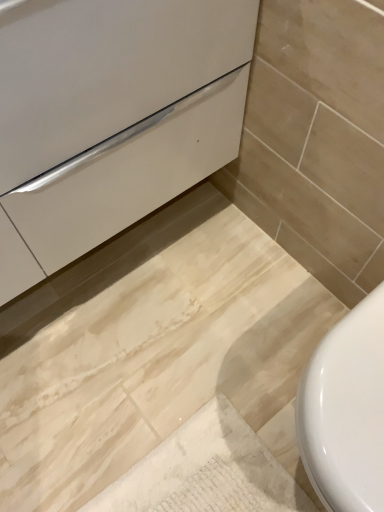
Question: Is white glossy drawer at center to the left or to the right of white glossy toilet at lower right in the image?

Choices:
 (A) left
 (B) right

Answer: (A)

Question: From a real-world perspective, is white glossy drawer at center positioned above or below white glossy toilet at lower right?

Choices:
 (A) below
 (B) above

Answer: (B)

Question: From the image's perspective, is white glossy drawer at center above or below white glossy toilet at lower right?

Choices:
 (A) above
 (B) below

Answer: (A)

Question: Considering their positions, is white glossy toilet at lower right located in front of or behind white glossy drawer at center?

Choices:
 (A) front
 (B) behind

Answer: (B)

Question: Does point (349, 435) appear closer or farther from the camera than point (153, 157)?

Choices:
 (A) farther
 (B) closer

Answer: (B)

Question: In terms of height, does white glossy toilet at lower right look taller or shorter compared to white glossy drawer at center?

Choices:
 (A) short
 (B) tall

Answer: (A)

Question: Visually, is white glossy toilet at lower right positioned to the left or to the right of white glossy drawer at center?

Choices:
 (A) left
 (B) right

Answer: (B)